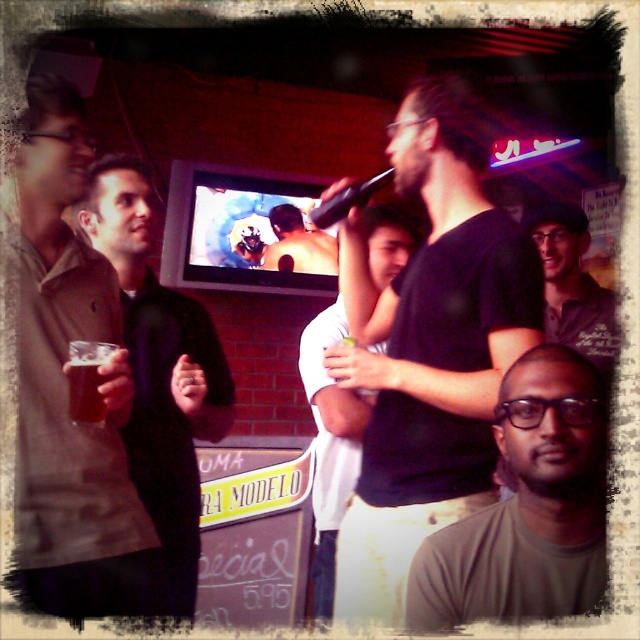
Question: From the image, what is the correct spatial relationship of white matte shirt at center in relation to dark green polo shirt at center?

Choices:
 (A) above
 (B) below

Answer: (B)

Question: Considering the real-world distances, which object is farthest from the matte brown shirt at left?

Choices:
 (A) black matte shirt at center
 (B) matte brown jacket at left
 (C) white matte shirt at center

Answer: (C)

Question: Does matte brown jacket at left appear on the right side of brown matte glass at left?

Choices:
 (A) yes
 (B) no

Answer: (B)

Question: From the image, what is the correct spatial relationship of black matte shirt at center in relation to brown matte glass at left?

Choices:
 (A) above
 (B) below

Answer: (A)

Question: Which point is farther to the camera?

Choices:
 (A) (145, 172)
 (B) (410, 221)
 (C) (77, 316)

Answer: (B)

Question: Which point is farther to the camera?

Choices:
 (A) (19, 209)
 (B) (467, 598)

Answer: (A)